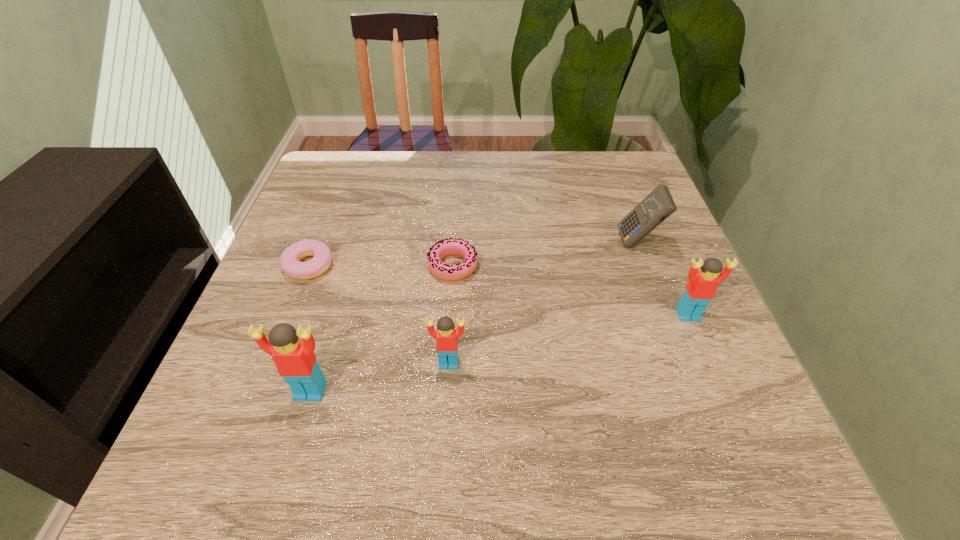
To make them evenly spaced by inserting another Lego among them, please locate a free space for this new Lego. Please provide its 2D coordinates. Your answer should be formatted as a tuple, i.e. [(x, y)], where the tuple contains the x and y coordinates of a point satisfying the conditions above.

[(574, 338)]